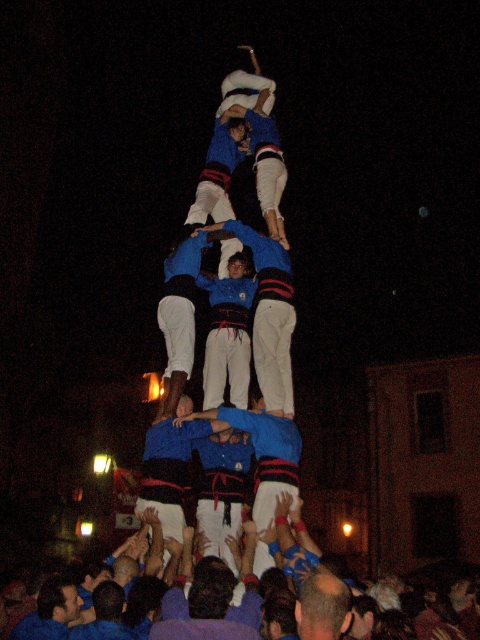
Does blue fabric pants at center appear on the right side of white cotton pants at center?

Yes, blue fabric pants at center is to the right of white cotton pants at center.

Does point (254, 236) lie in front of point (228, 308)?

Yes, point (254, 236) is in front of point (228, 308).

This screenshot has height=640, width=480. Find the location of `blue fabric pants at center`. blue fabric pants at center is located at coordinates (271, 317).

Does blue fabric pants at center have a larger size compared to bald head at center?

Correct, blue fabric pants at center is larger in size than bald head at center.

Does point (262, 349) come in front of point (302, 582)?

No, (262, 349) is further to viewer.

This screenshot has height=640, width=480. Identify the location of blue fabric pants at center. click(x=271, y=317).

I want to click on blue fabric pants at center, so click(271, 317).

In the scene shown: Between white cotton pants at center and bald head at center, which one appears on the left side from the viewer's perspective?

From the viewer's perspective, white cotton pants at center appears more on the left side.

Does white cotton pants at center have a lesser height compared to bald head at center?

In fact, white cotton pants at center may be taller than bald head at center.

Is point (231, 314) in front of point (336, 628)?

No, it is behind (336, 628).

Where is `white cotton pants at center`? This screenshot has width=480, height=640. white cotton pants at center is located at coordinates (228, 339).